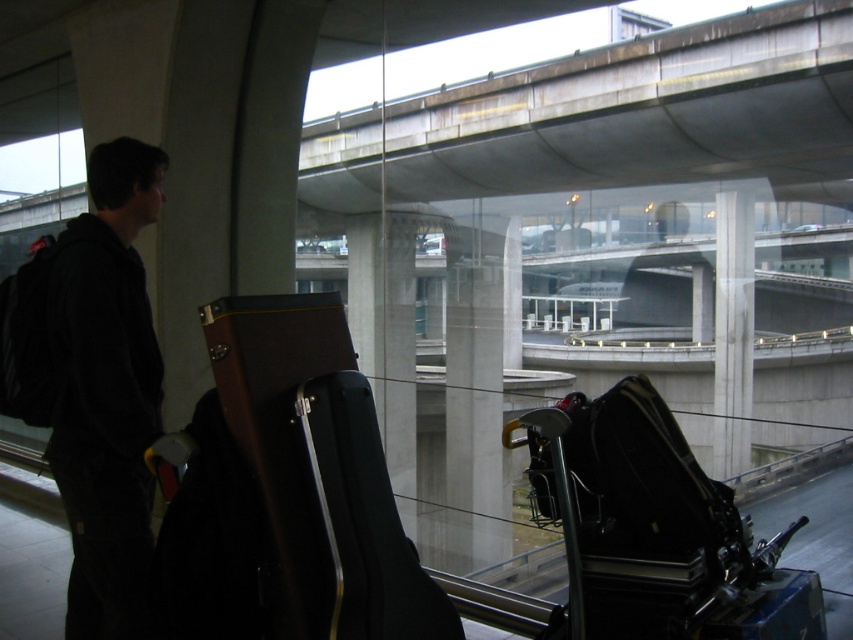
You are navigating through a busy airport terminal and need to locate two specific points marked in the scene. Which of the two points, point 1 at coordinates (561,148) or point 2 at coordinates (672,548), is closer to your current position?

Point 1 at coordinates (561,148) is closer to your current position because it is further to the viewer than point 2 at coordinates (672,548).

Consider the image. You are a traveler who needs to move your luggage to the departure gate. You see the black hardshell suitcase at lower right and the dark gray hoodie at left. Which of your items is located to the right side?

The black hardshell suitcase at lower right is positioned on the right side of the dark gray hoodie at left, so the black hardshell suitcase at lower right is located to the right side.